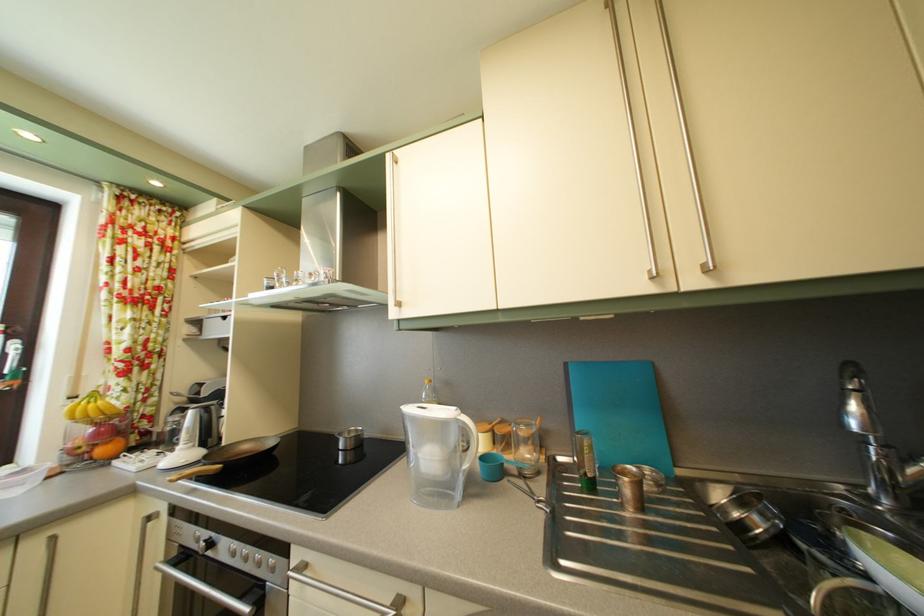
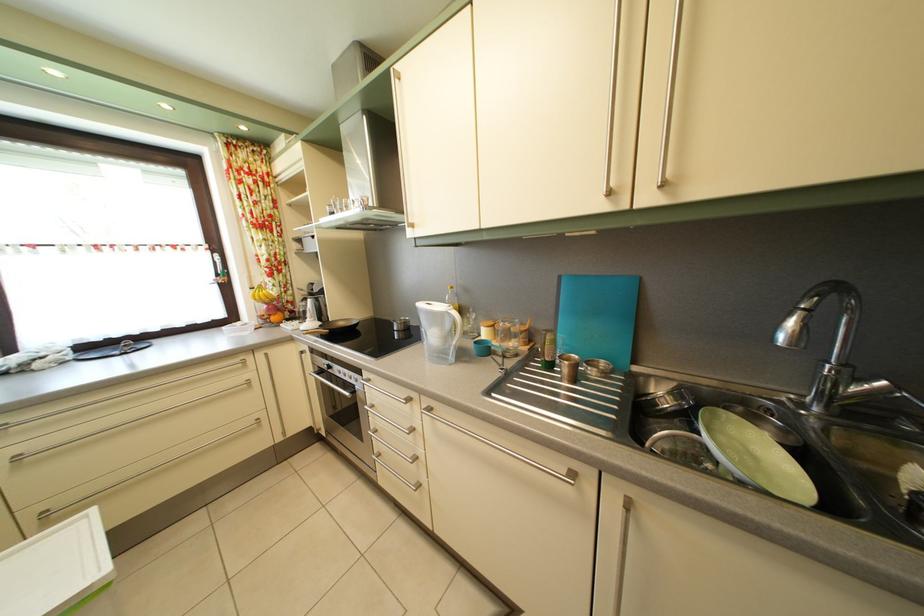
Question: I am providing you with two images of the same scene from different viewpoints. After the viewpoint changes to image2, which objects are now occluded?

Choices:
 (A) pan handle
 (B) oven door handle
 (C) clear glass bottle
 (D) none of these

Answer: (D)